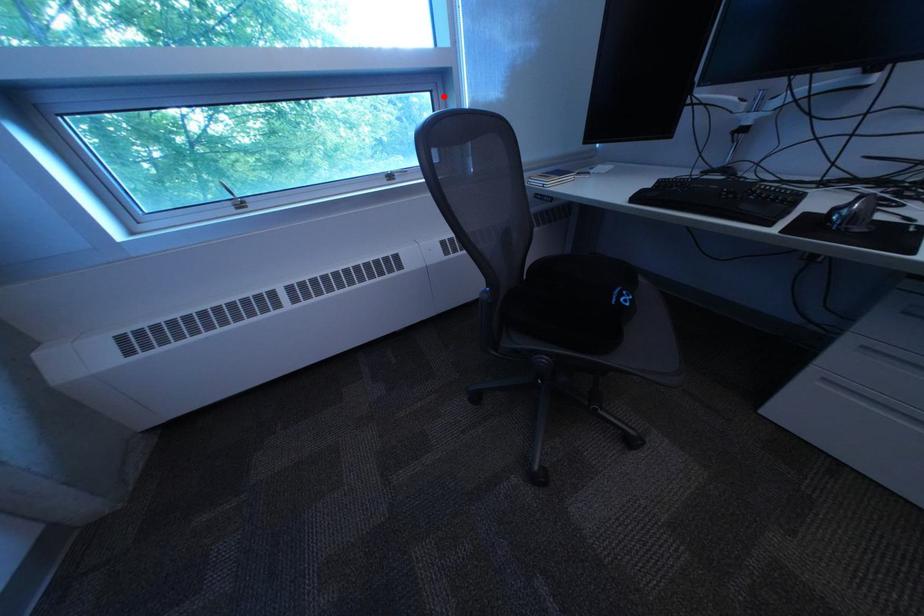
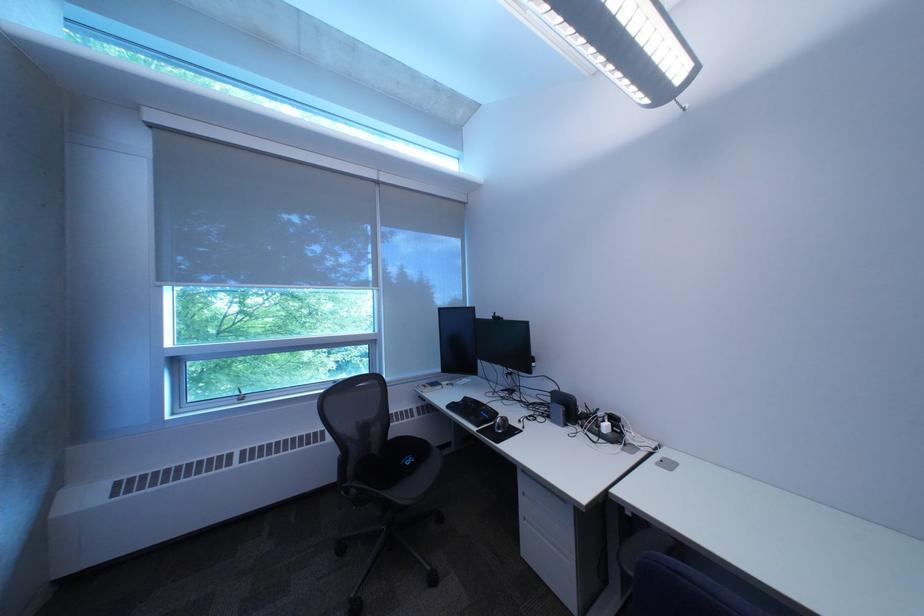
In the second image, find the point that corresponds to the highlighted location in the first image.

(383, 347)